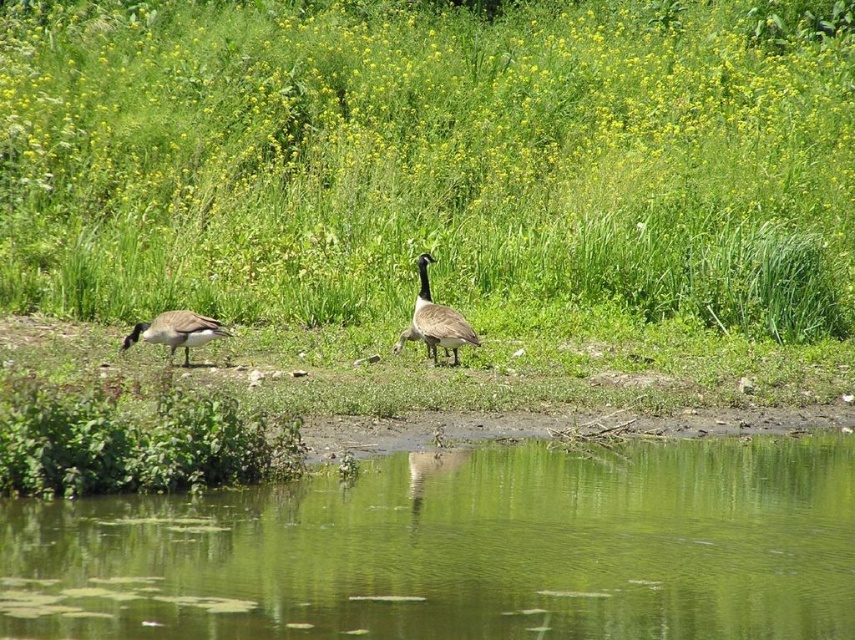
You are a photographer aiming to capture the brown feathered goose at center in the image. You want to ensure the green reflective water at center takes up more horizontal space in the photo than the goose. Is this possible based on the scene description?

Yes, because the green reflective water at center is wider than the brown feathered goose at center according to the description.

You are standing at the point closer to you in the image, which is point (228, 296). You want to walk towards the point (811, 490). Based on the scene description, will you be moving towards the background or the foreground?

You will be moving towards the background because point (228, 296) is closer to the camera than point (811, 490), so walking from the closer point to the farther one means moving into the background.

You are standing at the edge of the water and want to take a photo of the green reflective water at center. If your camera can focus up to 6 meters away, will you need to adjust your focus to capture it clearly?

The green reflective water at center is 6.45 meters away from the camera. Since the camera can only focus up to 6 meters, you will need to adjust your focus to capture it clearly.